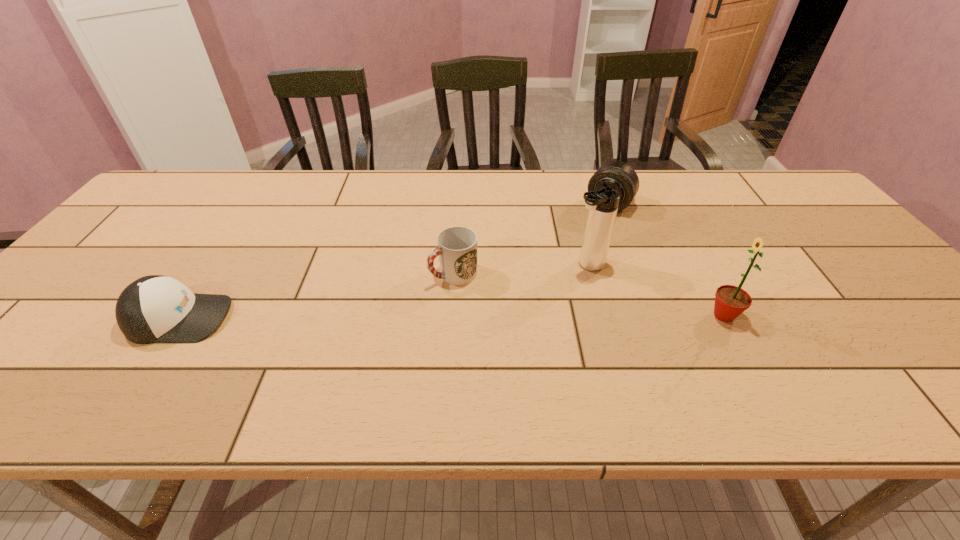
The height and width of the screenshot is (540, 960). In order to click on vacant space on the desktop that is between the leftmost object and the sunflower and is positioned on the handle side of the thermos bottle in this screenshot , I will do `click(476, 316)`.

Find the location of a particular element. The image size is (960, 540). free spot on the desktop that is between the cap and the sunflower and is positioned on the front-facing side of the third tallest object is located at coordinates (528, 316).

Where is `free space on the desktop that is between the cap and the sunflower and is positioned on the handle side of the cup`? This screenshot has width=960, height=540. free space on the desktop that is between the cap and the sunflower and is positioned on the handle side of the cup is located at coordinates (372, 317).